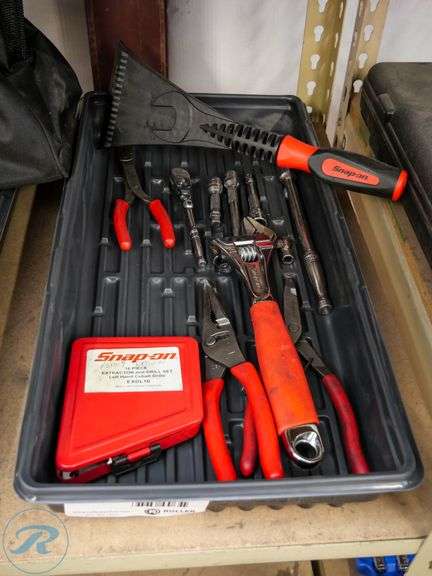
The width and height of the screenshot is (432, 576). Identify the location of shelf bracket. (314, 63).